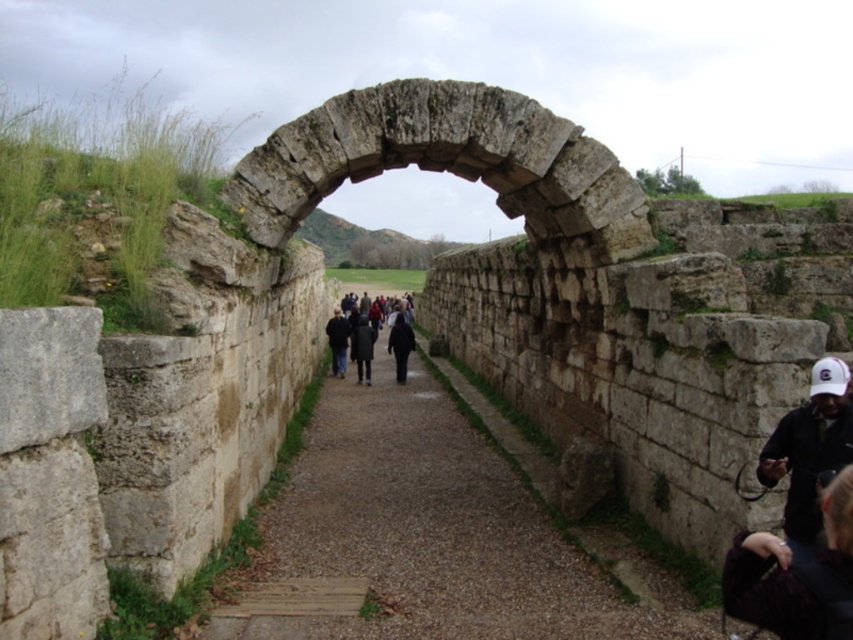
You are standing at the entrance of the ancient stone archway and see two people wearing jackets. One is wearing a dark purple jacket at lower right and the other a dark blue jacket at center. Which jacket is positioned to the right of the other?

The dark purple jacket at lower right is positioned on the right side of dark blue jacket at center.